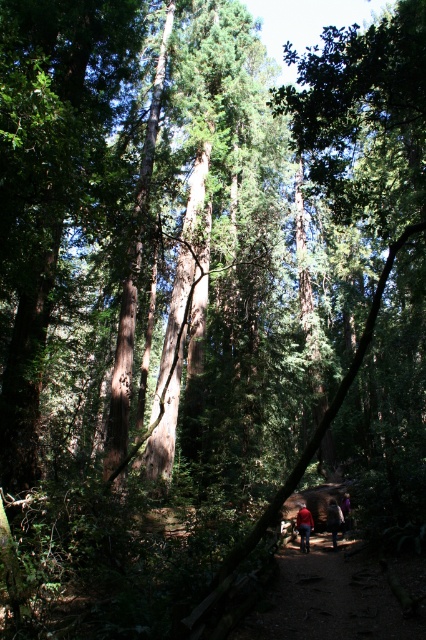
Between red matte jacket at center and dark brown leather jacket at center, which one has more height?

dark brown leather jacket at center is taller.

Which is more to the right, red matte jacket at center or dark brown leather jacket at center?

From the viewer's perspective, dark brown leather jacket at center appears more on the right side.

Where is `red matte jacket at center`? The image size is (426, 640). red matte jacket at center is located at coordinates (304, 525).

Where is `red matte jacket at center`? The height and width of the screenshot is (640, 426). red matte jacket at center is located at coordinates point(304,525).

Is red matte jacket at center above purple fabric at center?

Indeed, red matte jacket at center is positioned over purple fabric at center.

This screenshot has height=640, width=426. What do you see at coordinates (304, 525) in the screenshot?
I see `red matte jacket at center` at bounding box center [304, 525].

Where is `red matte jacket at center`? The height and width of the screenshot is (640, 426). red matte jacket at center is located at coordinates (304, 525).

What do you see at coordinates (333, 518) in the screenshot? Image resolution: width=426 pixels, height=640 pixels. I see `dark brown leather jacket at center` at bounding box center [333, 518].

Between dark brown leather jacket at center and purple fabric at center, which one appears on the right side from the viewer's perspective?

purple fabric at center

Measure the distance between dark brown leather jacket at center and camera.

dark brown leather jacket at center and camera are 12.66 meters apart from each other.

This screenshot has height=640, width=426. What are the coordinates of `dark brown leather jacket at center` in the screenshot? It's located at (333, 518).